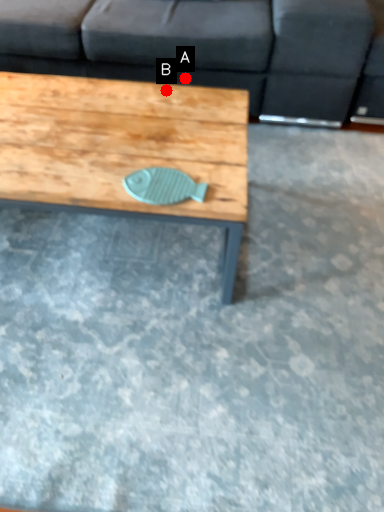
Question: Two points are circled on the image, labeled by A and B beside each circle. Among these points, which one is nearest to the camera?

Choices:
 (A) A is closer
 (B) B is closer

Answer: (B)